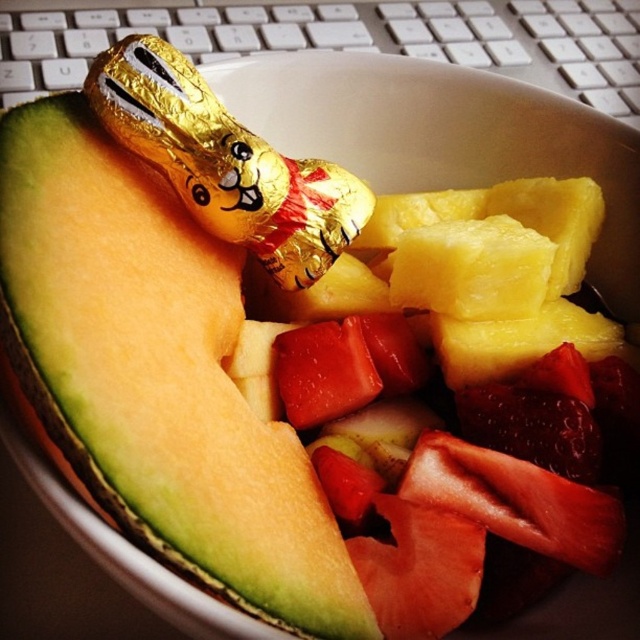
Who is taller, green matte cantaloupe at upper left or gold foil chocolate at upper center?

With more height is green matte cantaloupe at upper left.

Who is more forward, [97,323] or [236,176]?

Positioned in front is point [97,323].

Is point (198, 324) behind point (268, 216)?

That is False.

This screenshot has height=640, width=640. What are the coordinates of `green matte cantaloupe at upper left` in the screenshot? It's located at (157, 372).

Does point (132, 108) come behind point (243, 168)?

No, it is in front of (243, 168).

Does gold foil chocolate bunny at upper center appear over gold foil chocolate at upper center?

Yes.

Between point (298, 234) and point (262, 150), which one is positioned behind?

The point (298, 234) is behind.

You are a GUI agent. You are given a task and a screenshot of the screen. Output one action in this format:
    pyautogui.click(x=<x>, y=<y>)
    Task: Click on the gold foil chocolate bunny at upper center
    The width and height of the screenshot is (640, 640).
    Given the screenshot: What is the action you would take?
    pyautogui.click(x=225, y=163)

Is the position of green matte cantaloupe at upper left more distant than that of gold foil chocolate bunny at upper center?

No, it is not.

Which is above, green matte cantaloupe at upper left or gold foil chocolate bunny at upper center?

gold foil chocolate bunny at upper center is above.

Find the location of `green matte cantaloupe at upper left`. green matte cantaloupe at upper left is located at coordinates (157, 372).